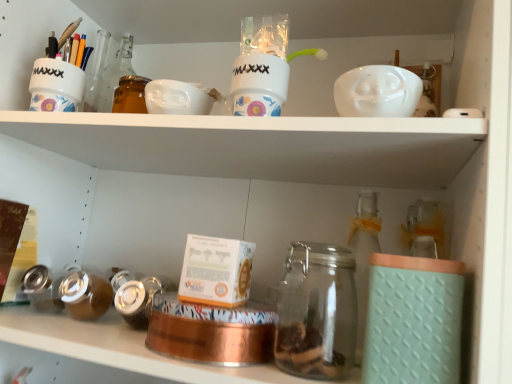
What do you see at coordinates (317, 312) in the screenshot?
I see `transparent glass jar at center` at bounding box center [317, 312].

The image size is (512, 384). In order to click on transparent glass jar at center in this screenshot , I will do `click(317, 312)`.

This screenshot has width=512, height=384. Find the location of `transparent glass jar at center`. transparent glass jar at center is located at coordinates (317, 312).